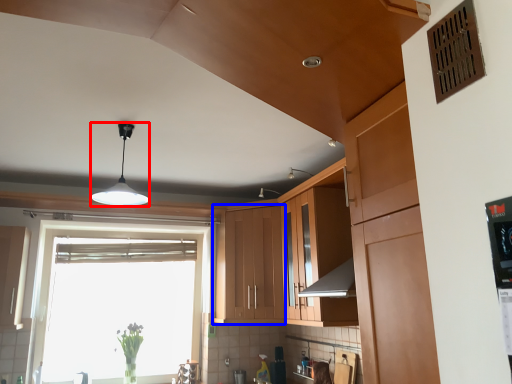
Question: Which object is further to the camera taking this photo, light fixture (highlighted by a red box) or cabinetry (highlighted by a blue box)?

Choices:
 (A) light fixture
 (B) cabinetry

Answer: (B)